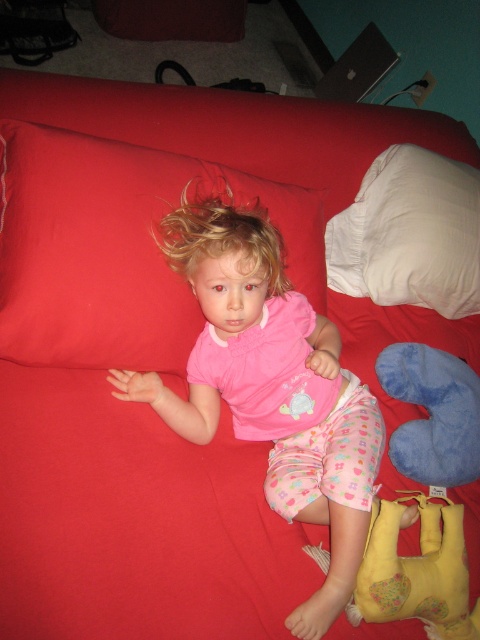
Which is behind, point (397, 280) or point (429, 616)?

Positioned behind is point (397, 280).

Is white soft pillow at upper right thinner than yellow fabric stuffed animal at lower right?

In fact, white soft pillow at upper right might be wider than yellow fabric stuffed animal at lower right.

Identify the location of white soft pillow at upper right. The height and width of the screenshot is (640, 480). (409, 234).

Where is `white soft pillow at upper right`? This screenshot has width=480, height=640. white soft pillow at upper right is located at coordinates (409, 234).

Is point (351, 547) less distant than point (278, 294)?

Yes, it is in front of point (278, 294).

Who is taller, pink fabric child at center or blonde curly hair at center?

pink fabric child at center

Locate an element on the screen. Image resolution: width=480 pixels, height=640 pixels. pink fabric child at center is located at coordinates (271, 387).

Is white soft pillow at upper right to the right of blue soft pillow at lower right from the viewer's perspective?

In fact, white soft pillow at upper right is to the left of blue soft pillow at lower right.

Can you confirm if white soft pillow at upper right is thinner than blue soft pillow at lower right?

In fact, white soft pillow at upper right might be wider than blue soft pillow at lower right.

This screenshot has width=480, height=640. Describe the element at coordinates (409, 234) in the screenshot. I see `white soft pillow at upper right` at that location.

You are a GUI agent. You are given a task and a screenshot of the screen. Output one action in this format:
    pyautogui.click(x=<x>, y=<y>)
    Task: Click on the white soft pillow at upper right
    This screenshot has height=640, width=480.
    Given the screenshot: What is the action you would take?
    pyautogui.click(x=409, y=234)